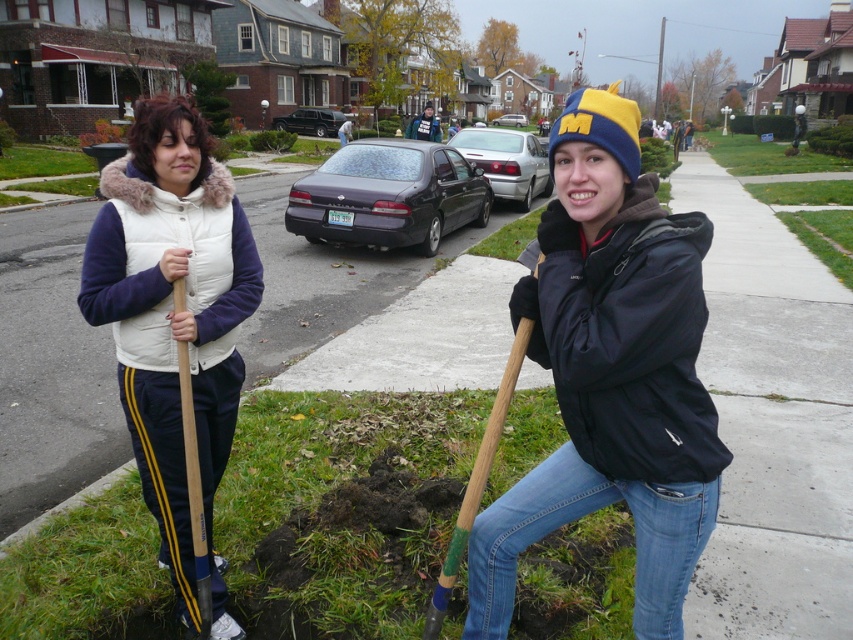
Question: Observing the image, what is the correct spatial positioning of matte black jacket at center in reference to white fleece vest at left?

Choices:
 (A) above
 (B) below

Answer: (A)

Question: Considering the real-world distances, which object is farthest from the matte black jacket at center?

Choices:
 (A) white fleece vest at left
 (B) wooden shovel at lower right

Answer: (A)

Question: Is matte black jacket at center closer to the viewer compared to wooden shovel at lower right?

Choices:
 (A) no
 (B) yes

Answer: (B)

Question: Which of the following is the farthest from the observer?

Choices:
 (A) white fleece vest at left
 (B) wooden shovel at lower right
 (C) matte black jacket at center

Answer: (A)

Question: Considering the relative positions of white fleece vest at left and wooden shovel at lower right in the image provided, where is white fleece vest at left located with respect to wooden shovel at lower right?

Choices:
 (A) above
 (B) below

Answer: (A)

Question: Which is farther from the matte black jacket at center?

Choices:
 (A) wooden shovel at lower right
 (B) white fleece vest at left

Answer: (B)